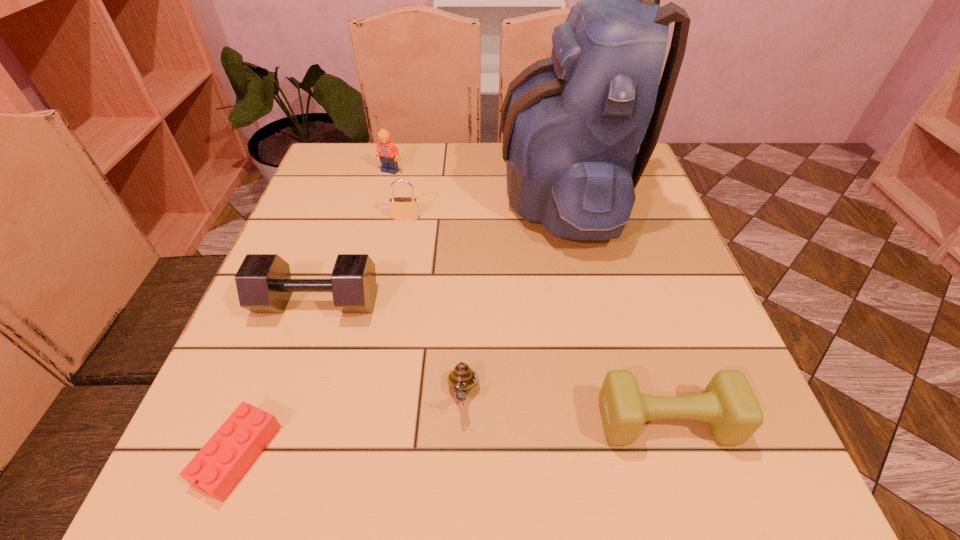
The image size is (960, 540). I want to click on the nearer Lego, so click(x=217, y=468).

The width and height of the screenshot is (960, 540). Find the location of `vacant position located 0.340m at the front pocket of the backpack`. vacant position located 0.340m at the front pocket of the backpack is located at coordinates (364, 193).

Identify the location of blank area located 0.170m at the front pocket of the backpack. (432, 193).

The image size is (960, 540). I want to click on free space located 0.220m at the front pocket of the backpack, so click(412, 193).

The width and height of the screenshot is (960, 540). I want to click on vacant space located 0.250m on the front-facing side of the taller Lego, so click(x=373, y=237).

Where is `free space located on the front-facing side of the padlock`? The height and width of the screenshot is (540, 960). free space located on the front-facing side of the padlock is located at coordinates (x=389, y=309).

At what (x,y) coordinates should I click in order to perform the action: click on free location located 0.220m on the right of the left dumbbell. Please return your answer as a coordinate pair (x, y). Looking at the image, I should click on (488, 302).

Where is `vacant area situated on the face of the snail`? The height and width of the screenshot is (540, 960). vacant area situated on the face of the snail is located at coordinates (461, 489).

Find the location of a particular element. Image resolution: width=960 pixels, height=540 pixels. vacant position located on the back of the nearer dumbbell is located at coordinates (641, 341).

At what (x,y) coordinates should I click in order to perform the action: click on vacant point located 0.100m on the right of the shorter Lego. Please return your answer as a coordinate pair (x, y). Looking at the image, I should click on (340, 455).